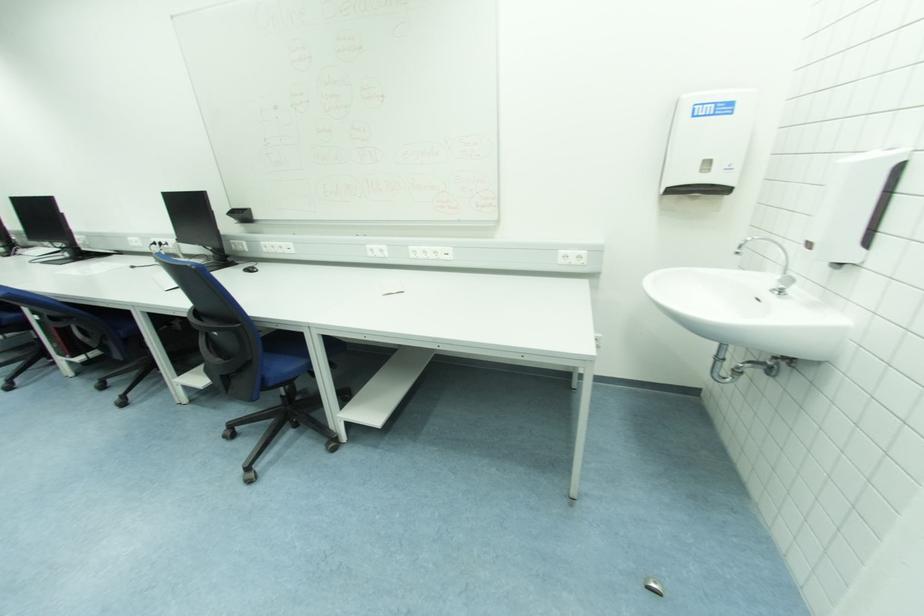
At what (x,y) coordinates should I click in order to perform the action: click on black computer mouse. Please return your answer as a coordinate pair (x, y). Looking at the image, I should click on (250, 268).